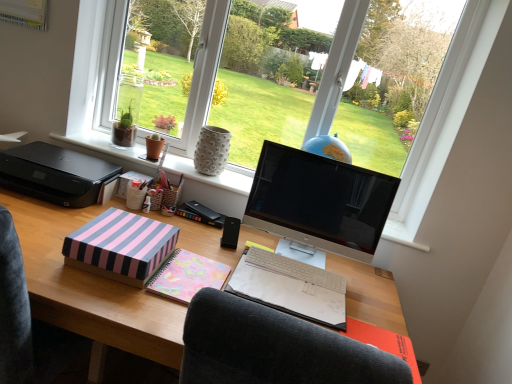
You are a GUI agent. You are given a task and a screenshot of the screen. Output one action in this format:
    pyautogui.click(x=<x>, y=<y>)
    Task: Click on the free space to the back side of pink striped cardboard box at center-left
    Image resolution: width=512 pixels, height=384 pixels.
    Given the screenshot: What is the action you would take?
    pyautogui.click(x=182, y=228)